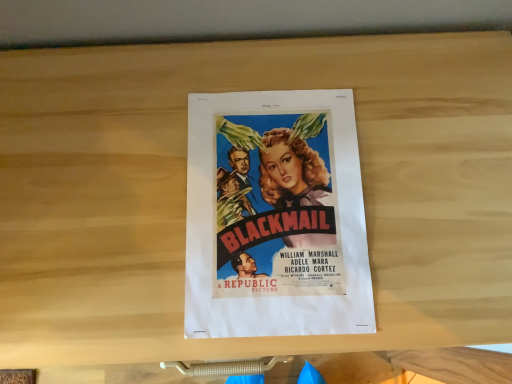
The height and width of the screenshot is (384, 512). In order to click on vacant space situated above matte paper poster at center (from a real-world perspective) in this screenshot , I will do `click(279, 215)`.